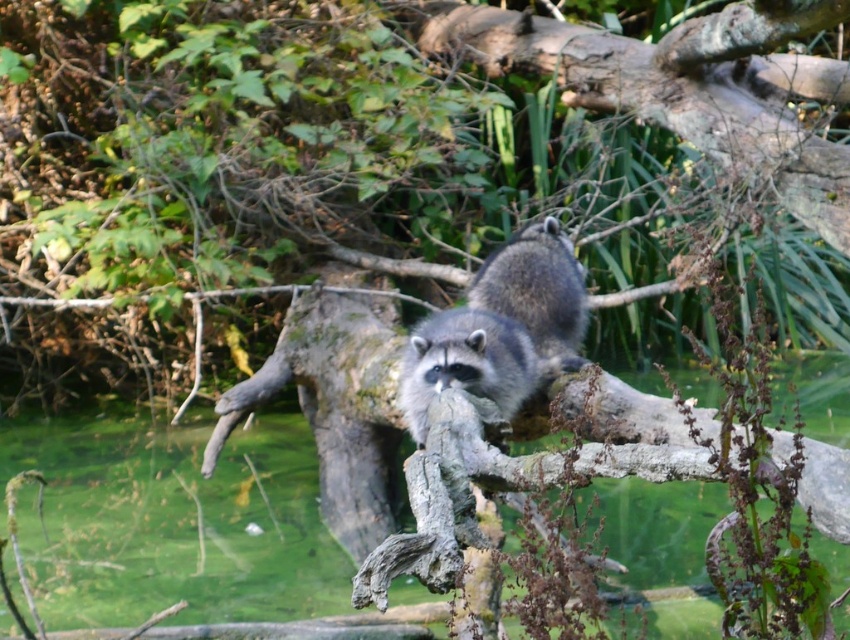
You are a wildlife photographer aiming to capture a photo of both fuzzy gray raccoon at center and fuzzy gray raccoon at upper center. Given that your camera can focus on subjects within a 15 inch range, will you be able to include both raccoons in the same focused shot?

The fuzzy gray raccoon at center and fuzzy gray raccoon at upper center are 16.47 inches apart. Since the distance between them exceeds the camera focus range of 15 inches, you cannot focus on both raccoons simultaneously in the same shot.

You are observing two raccoons on a tree branch. There is a fuzzy gray raccoon at center and another raccoon partially hidden behind it. Which raccoon is closer to you?

The fuzzy gray raccoon at center is closer to you since it is positioned in front and obscures the other raccoon.